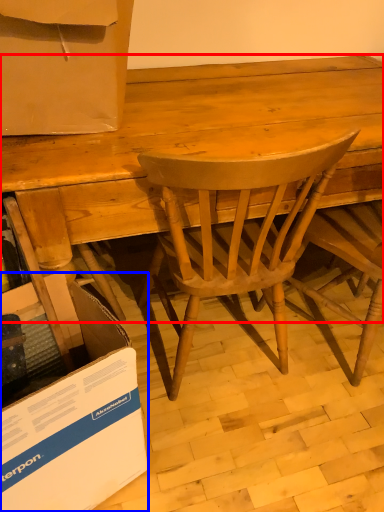
Question: Which point is further to the camera, desk (highlighted by a red box) or cardboard box (highlighted by a blue box)?

Choices:
 (A) desk
 (B) cardboard box

Answer: (A)